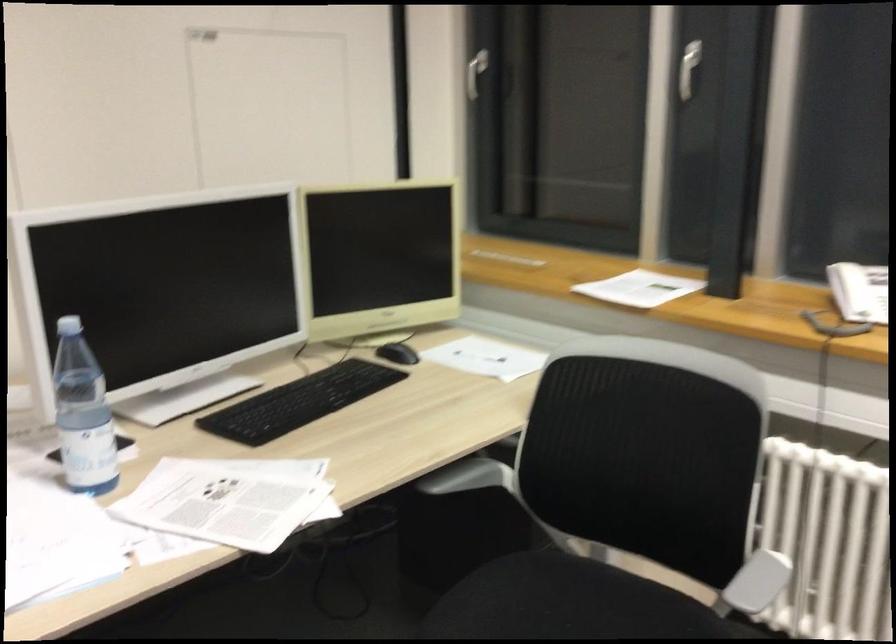
Where is `chair sitting surface`? The width and height of the screenshot is (896, 644). chair sitting surface is located at coordinates (x=570, y=603).